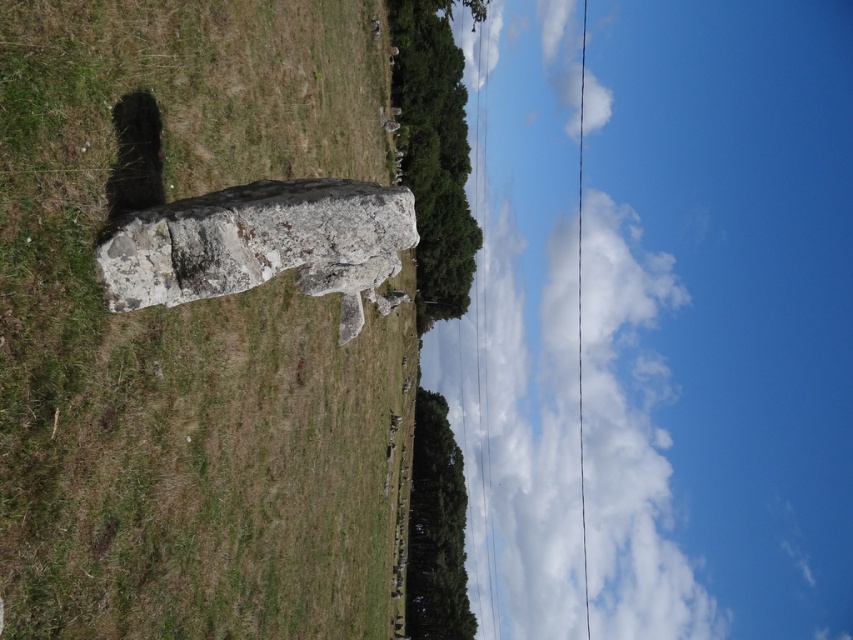
You are standing in the grassy field and want to locate the speckled stone monolith at center. What are the coordinates of its position?

The coordinates of the speckled stone monolith at center are at point (186,332).

You are standing in the field near the monument and want to take a photo of the white fluffy cloud at upper center. If your camera has a maximum range of 300 feet, will you be able to capture the cloud in your photo?

The white fluffy cloud at upper center is 342.33 feet away from the camera, which exceeds the camera maximum range of 300 feet. Therefore, you cannot capture the cloud in your photo.